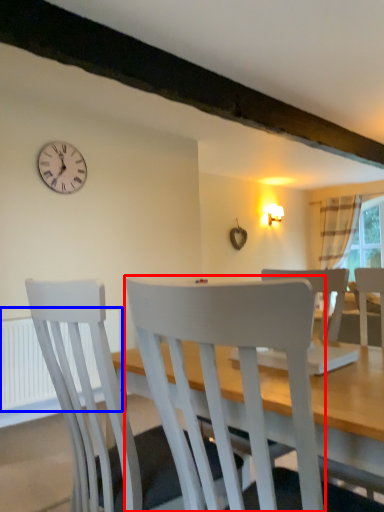
Question: Which object is further to the camera taking this photo, chair (highlighted by a red box) or radiator (highlighted by a blue box)?

Choices:
 (A) chair
 (B) radiator

Answer: (B)